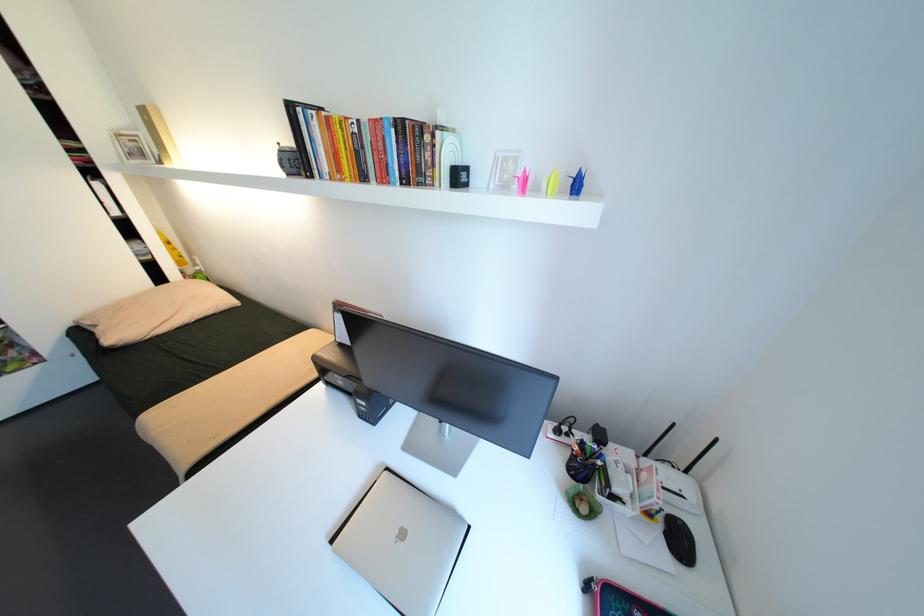
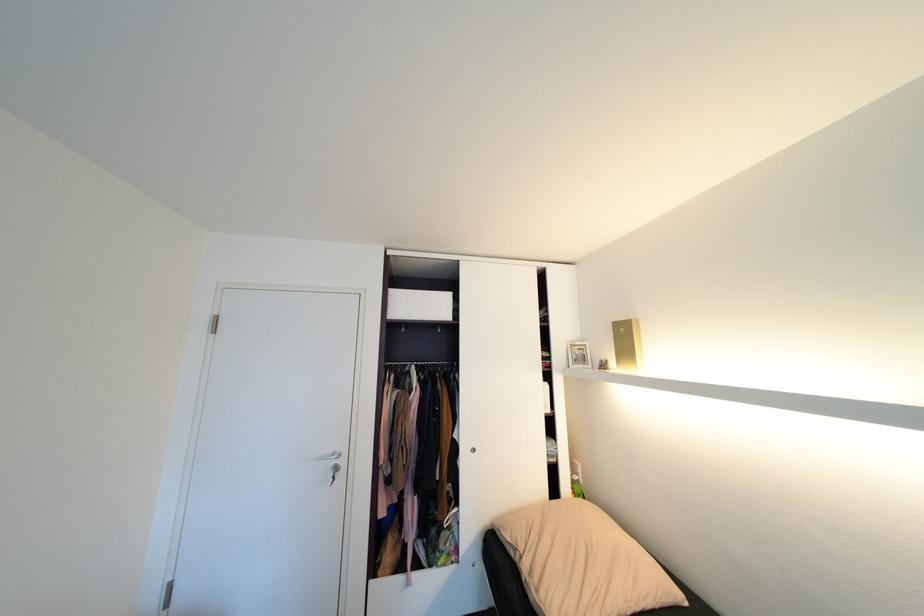
Locate, in the second image, the point that corresponds to the point at 138,140 in the first image.

(587, 350)